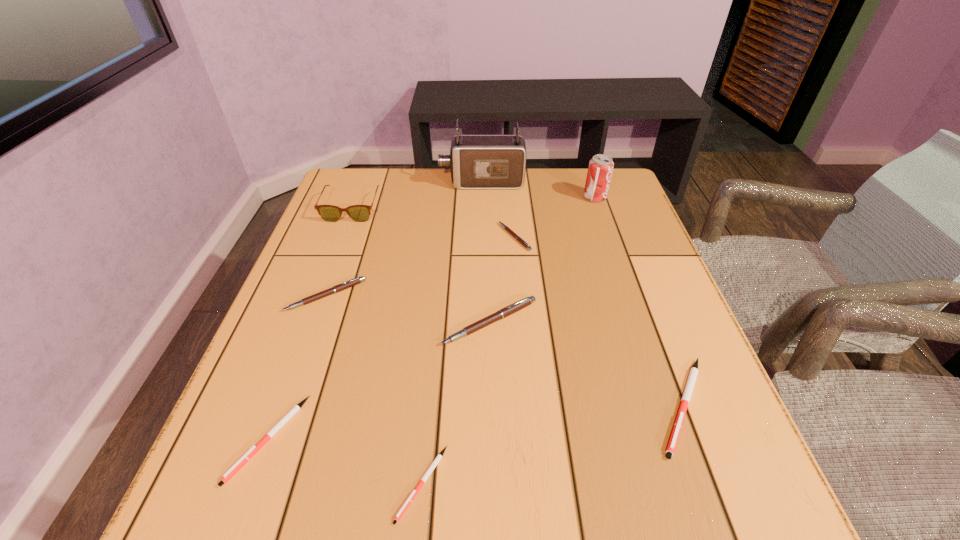
Where is `the second closest white pen relative to the rightmost pen`? This screenshot has height=540, width=960. the second closest white pen relative to the rightmost pen is located at coordinates (296, 408).

At what (x,y) coordinates should I click in order to perform the action: click on white pen that is the third closest to the spectacles. Please return your answer as a coordinate pair (x, y). The height and width of the screenshot is (540, 960). Looking at the image, I should click on (687, 393).

Image resolution: width=960 pixels, height=540 pixels. Identify the location of vacant space that satisfies the following two spatial constraints: 1. at the nib of the sixth nearest object; 2. on the clicker of the leftmost white pen. point(534,439).

In order to click on vacant space that satisfies the following two spatial constraints: 1. at the lens of the soda can; 2. on the left side of the camcorder in this screenshot , I will do `click(482, 198)`.